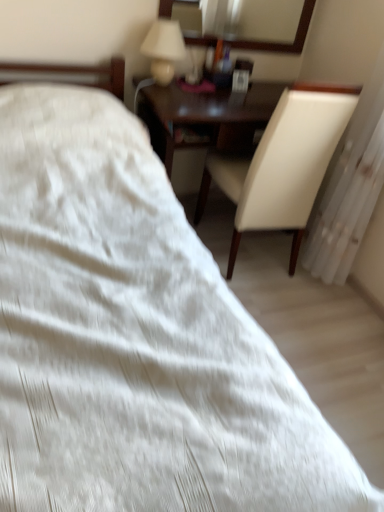
What do you see at coordinates (279, 42) in the screenshot? I see `wooden-framed mirror at upper center` at bounding box center [279, 42].

You are a GUI agent. You are given a task and a screenshot of the screen. Output one action in this format:
    pyautogui.click(x=<x>, y=<y>)
    Task: Click on the wooden-framed mirror at upper center
    This screenshot has height=512, width=384.
    Given the screenshot: What is the action you would take?
    pyautogui.click(x=279, y=42)

I want to click on table lamp that is on the left side of wooden-framed mirror at upper center, so click(x=164, y=49).

Based on the photo, considering the relative sizes of matte white lampshade at upper center and wooden-framed mirror at upper center in the image provided, is matte white lampshade at upper center bigger than wooden-framed mirror at upper center?

Yes, matte white lampshade at upper center is bigger than wooden-framed mirror at upper center.

Is the surface of matte white lampshade at upper center in direct contact with wooden-framed mirror at upper center?

No, matte white lampshade at upper center is not touching wooden-framed mirror at upper center.

Is wooden-framed mirror at upper center a part of matte white lampshade at upper center?

No, matte white lampshade at upper center does not contain wooden-framed mirror at upper center.

From the picture: Can we say wooden-framed mirror at upper center lies outside matte white lampshade at upper center?

Yes, wooden-framed mirror at upper center is outside of matte white lampshade at upper center.

From the picture: Is wooden-framed mirror at upper center placed right next to matte white lampshade at upper center?

No, wooden-framed mirror at upper center is not in contact with matte white lampshade at upper center.

In the image, is wooden-framed mirror at upper center positioned in front of or behind matte white lampshade at upper center?

wooden-framed mirror at upper center is behind matte white lampshade at upper center.

From the picture: Which of these two, white leather chair at right or white fabric radiator at right, is smaller?

Smaller between the two is white fabric radiator at right.

Looking at this image, is white leather chair at right thinner than white fabric radiator at right?

Incorrect, the width of white leather chair at right is not less than that of white fabric radiator at right.

Which is in front, white leather chair at right or white fabric radiator at right?

white fabric radiator at right is in front.

From a real-world perspective, does white leather chair at right sit lower than white fabric radiator at right?

A: Yes, from a real-world perspective, white leather chair at right is under white fabric radiator at right.

What's the angular difference between white fabric radiator at right and matte white lampshade at upper center's facing directions?

The angle between the facing direction of white fabric radiator at right and the facing direction of matte white lampshade at upper center is 94.7 degrees.

Is point (376, 125) positioned after point (162, 46)?

That is False.

Between white fabric radiator at right and matte white lampshade at upper center, which one has smaller width?

matte white lampshade at upper center.

Does white fabric radiator at right have a larger size compared to matte white lampshade at upper center?

Correct, white fabric radiator at right is larger in size than matte white lampshade at upper center.

Choose the correct answer: Is matte white lampshade at upper center inside white leather chair at right or outside it?

matte white lampshade at upper center is outside white leather chair at right.

Is point (161, 70) less distant than point (296, 205)?

Yes, point (161, 70) is in front of point (296, 205).

Which object is positioned more to the left, matte white lampshade at upper center or white leather chair at right?

Positioned to the left is matte white lampshade at upper center.

Is matte white lampshade at upper center aimed at white leather chair at right?

No, matte white lampshade at upper center is not aimed at white leather chair at right.

Does matte white lampshade at upper center have a larger size compared to white fabric radiator at right?

Incorrect, matte white lampshade at upper center is not larger than white fabric radiator at right.

Who is shorter, matte white lampshade at upper center or white fabric radiator at right?

With less height is matte white lampshade at upper center.

Consider the image. Are matte white lampshade at upper center and white fabric radiator at right located far from each other?

Indeed, matte white lampshade at upper center is not near white fabric radiator at right.

Is white fabric radiator at right surrounding white leather chair at right?

No, white leather chair at right is not inside white fabric radiator at right.

Looking at this image, considering the positions of objects white fabric radiator at right and white leather chair at right in the image provided, who is in front, white fabric radiator at right or white leather chair at right?

white fabric radiator at right is more forward.

Can you confirm if white fabric radiator at right is wider than white leather chair at right?

In fact, white fabric radiator at right might be narrower than white leather chair at right.

Considering the positions of point (342, 250) and point (308, 202), is point (342, 250) closer or farther from the camera than point (308, 202)?

Clearly, point (342, 250) is closer to the camera than point (308, 202).

Locate an element on the screen. table lamp that is on the left side of wooden-framed mirror at upper center is located at coordinates (164, 49).

At what (x,y) coordinates should I click in order to perform the action: click on table lamp below the wooden-framed mirror at upper center (from the image's perspective). Please return your answer as a coordinate pair (x, y). The width and height of the screenshot is (384, 512). Looking at the image, I should click on (164, 49).

Considering their positions, is matte white lampshade at upper center positioned closer to white leather chair at right than white fabric radiator at right?

The object closer to white leather chair at right is white fabric radiator at right.

When comparing their distances from wooden-framed mirror at upper center, does white fabric radiator at right or matte white lampshade at upper center seem closer?

Among the two, matte white lampshade at upper center is located nearer to wooden-framed mirror at upper center.

Looking at the image, which one is located further to matte white lampshade at upper center, white leather chair at right or white fabric radiator at right?

Based on the image, white fabric radiator at right appears to be further to matte white lampshade at upper center.

Estimate the real-world distances between objects in this image. Which object is closer to wooden-framed mirror at upper center, white leather chair at right or white fabric radiator at right?

Among the two, white leather chair at right is located nearer to wooden-framed mirror at upper center.

Looking at the image, which one is located further to white fabric radiator at right, white leather chair at right or matte white lampshade at upper center?

matte white lampshade at upper center is further to white fabric radiator at right.

When comparing their distances from matte white lampshade at upper center, does white leather chair at right or wooden-framed mirror at upper center seem closer?

Based on the image, wooden-framed mirror at upper center appears to be nearer to matte white lampshade at upper center.

Consider the image. Which object lies nearer to the anchor point white fabric radiator at right, wooden-framed mirror at upper center or white leather chair at right?

Among the two, white leather chair at right is located nearer to white fabric radiator at right.

Estimate the real-world distances between objects in this image. Which object is further from matte white lampshade at upper center, wooden-framed mirror at upper center or white fabric radiator at right?

white fabric radiator at right.

This screenshot has height=512, width=384. I want to click on mirror situated between matte white lampshade at upper center and white fabric radiator at right from left to right, so click(x=279, y=42).

Where is `chair that lies between wooden-framed mirror at upper center and white fabric radiator at right from top to bottom`? Image resolution: width=384 pixels, height=512 pixels. chair that lies between wooden-framed mirror at upper center and white fabric radiator at right from top to bottom is located at coordinates (282, 164).

Identify the location of chair between matte white lampshade at upper center and white fabric radiator at right in the horizontal direction. The height and width of the screenshot is (512, 384). (282, 164).

Where is `table lamp that lies between wooden-framed mirror at upper center and white leather chair at right from top to bottom`? The image size is (384, 512). table lamp that lies between wooden-framed mirror at upper center and white leather chair at right from top to bottom is located at coordinates (164, 49).